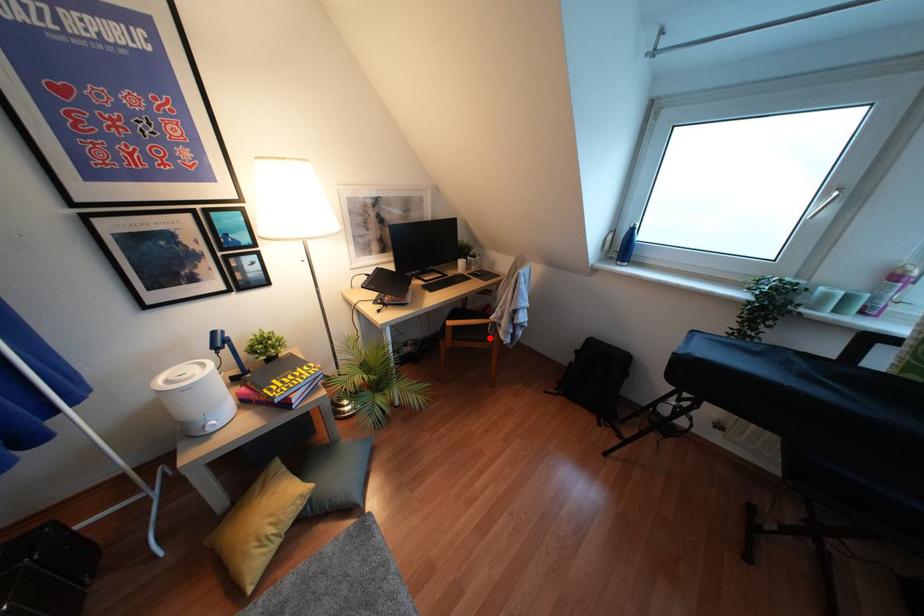
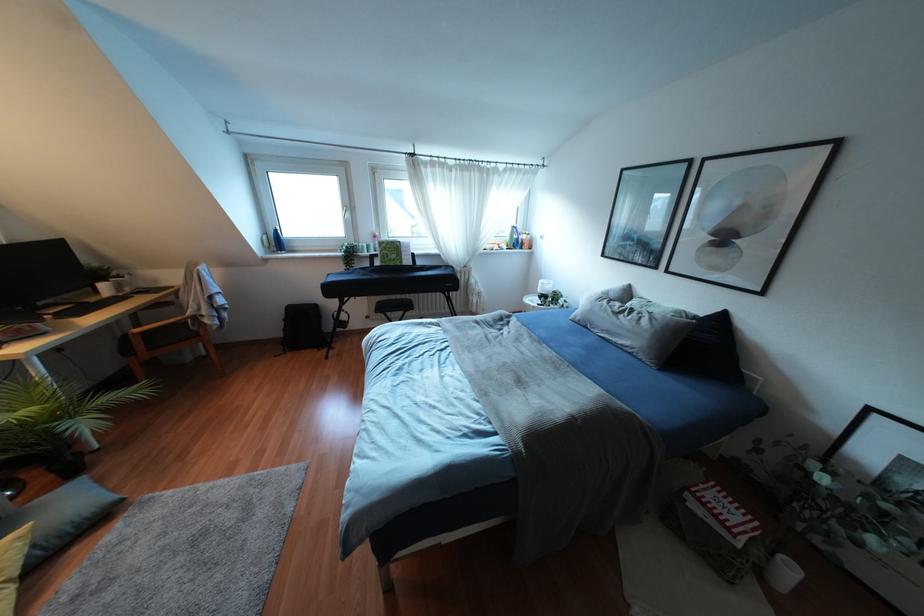
Locate, in the second image, the point that corresponds to the highlighted location in the first image.

(196, 334)